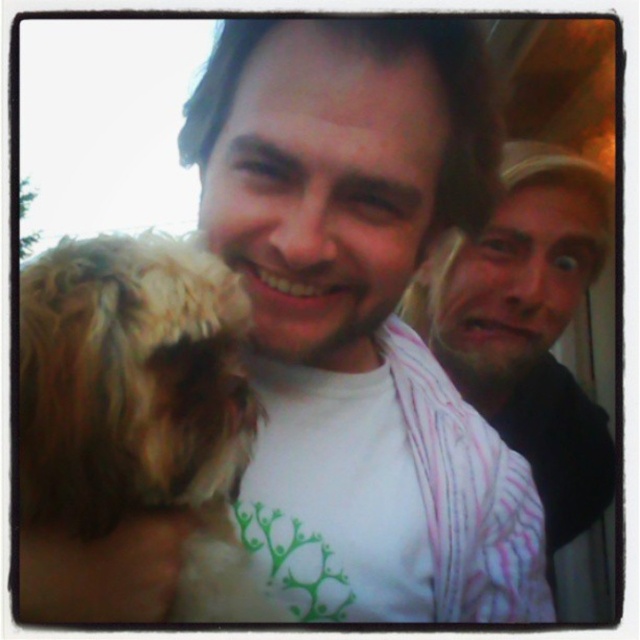
Question: Which point appears closest to the camera in this image?

Choices:
 (A) (557, 320)
 (B) (74, 248)

Answer: (B)

Question: Is fuzzy brown dog at left smaller than pink striped shirt at right?

Choices:
 (A) no
 (B) yes

Answer: (B)

Question: Is fuzzy brown dog at left positioned behind pink striped shirt at right?

Choices:
 (A) yes
 (B) no

Answer: (B)

Question: Which point is closer to the camera taking this photo?

Choices:
 (A) (102, 312)
 (B) (572, 248)

Answer: (A)

Question: Does fuzzy brown dog at left have a lesser width compared to pink striped shirt at right?

Choices:
 (A) yes
 (B) no

Answer: (A)